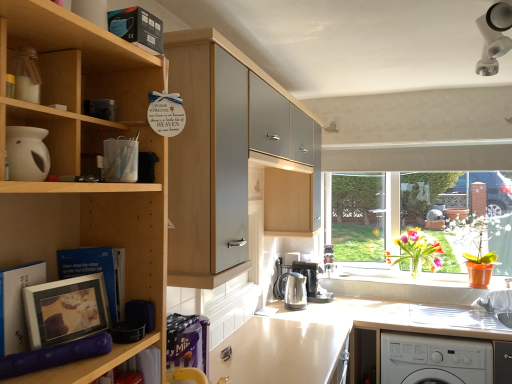
Question: From their relative heights in the image, would you say light brown laminate counter top at center is taller or shorter than matte silver picture frame at left?

Choices:
 (A) short
 (B) tall

Answer: (B)

Question: Is point (344, 327) closer or farther from the camera than point (99, 273)?

Choices:
 (A) farther
 (B) closer

Answer: (A)

Question: Based on their relative distances, which object is nearer to the matte black book at lower left, the second book in the front-to-back sequence?

Choices:
 (A) matte purple foam roller at lower left
 (B) vibrant glass vase at window
 (C) matte silver picture frame at left
 (D) matte white photo frame at lower left, which ranks as the 1th book in front-to-back order
 (E) satin black coffee machine at lower center

Answer: (C)

Question: Estimate the real-world distances between objects in this image. Which object is closer to the wooden cabinet at upper center?

Choices:
 (A) light brown laminate counter top at center
 (B) white plastic washing machine at lower right
 (C) matte silver picture frame at left
 (D) orange plastic pot at lower center
 (E) matte purple foam roller at lower left

Answer: (C)